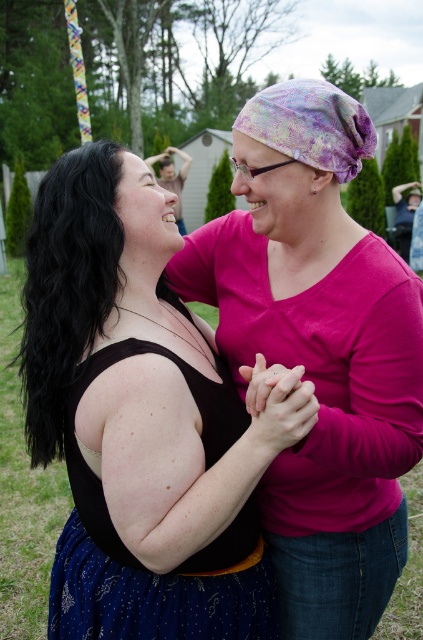
Question: Is pink fabric shirt at center wider than dark blue textured dress at center?

Choices:
 (A) yes
 (B) no

Answer: (A)

Question: Which of these objects is positioned closest to the dark blue textured dress at center?

Choices:
 (A) matte pink shirt at center
 (B) pastel tie-dye fabric headscarf at center

Answer: (A)

Question: Where is matte pink shirt at center located in relation to pastel tie-dye fabric headscarf at center in the image?

Choices:
 (A) above
 (B) below

Answer: (B)

Question: Among these objects, which one is nearest to the camera?

Choices:
 (A) matte pink shirt at center
 (B) pink fabric shirt at center
 (C) pastel tie-dye fabric headscarf at center

Answer: (A)

Question: Which point is farther to the camera?

Choices:
 (A) pastel tie-dye fabric headscarf at center
 (B) dark blue textured dress at center
 (C) matte pink shirt at center

Answer: (A)

Question: Is dark blue textured dress at center thinner than pastel tie-dye fabric headscarf at center?

Choices:
 (A) yes
 (B) no

Answer: (B)